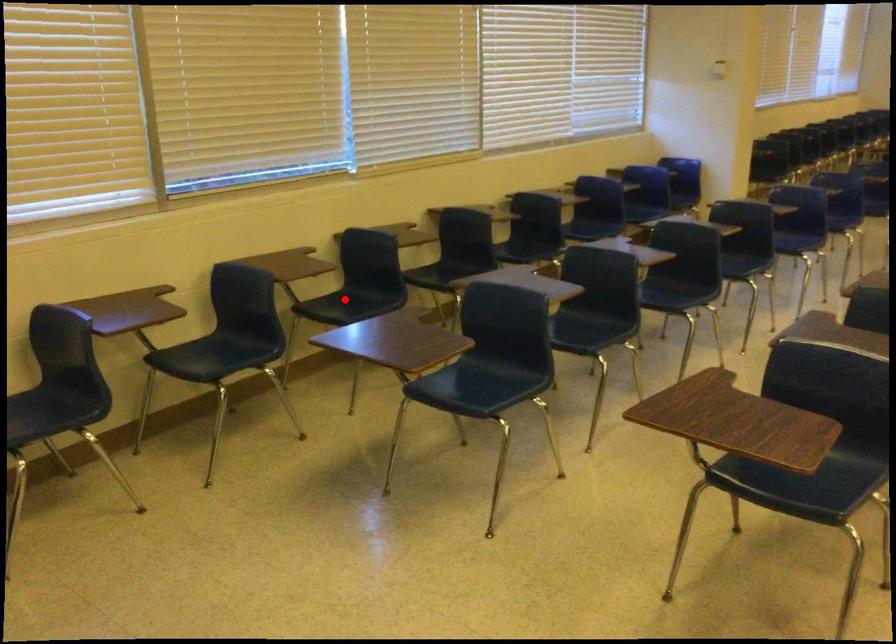
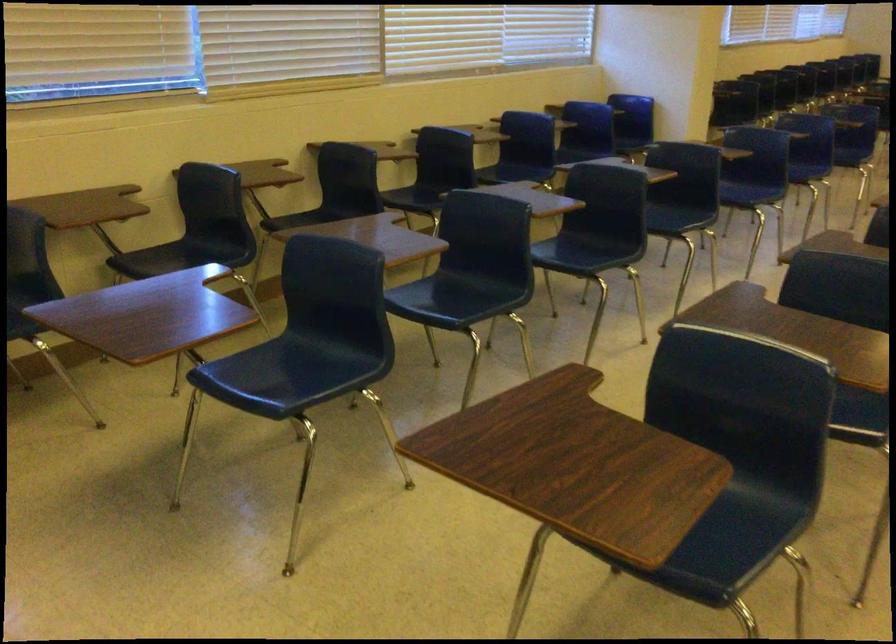
Locate, in the second image, the point that corresponds to the highlighted location in the first image.

(181, 257)